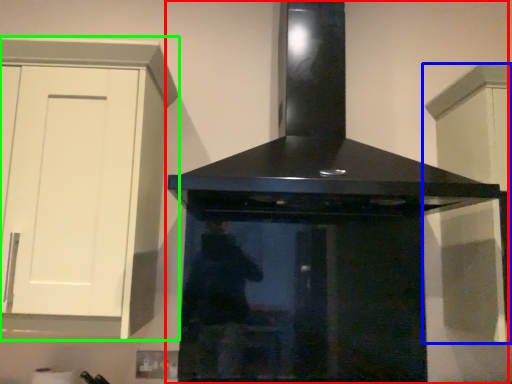
Question: Which object is positioned closest to home appliance (highlighted by a red box)? Select from cabinetry (highlighted by a blue box) and cabinetry (highlighted by a green box).

Choices:
 (A) cabinetry
 (B) cabinetry

Answer: (A)